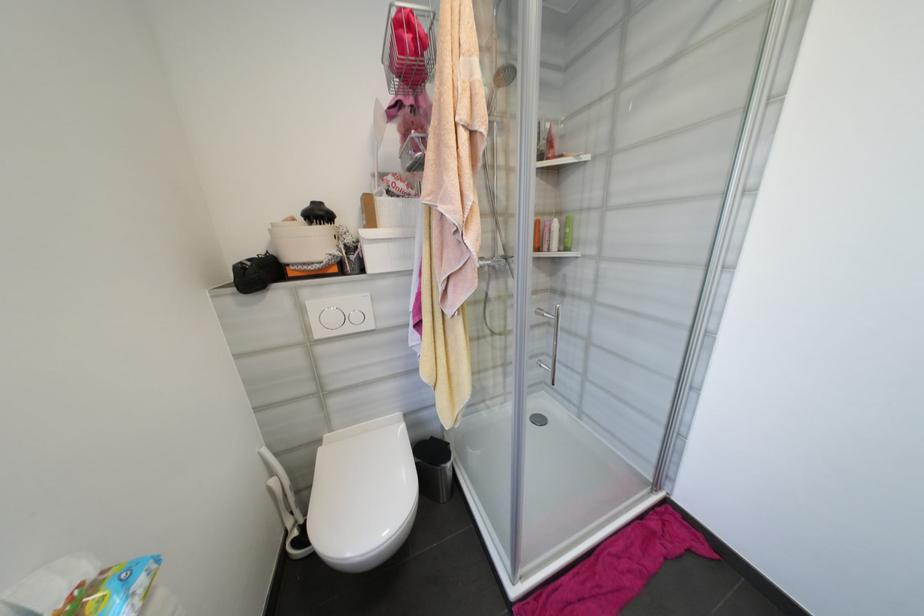
Find the location of `orange bottle`. orange bottle is located at coordinates (537, 235).